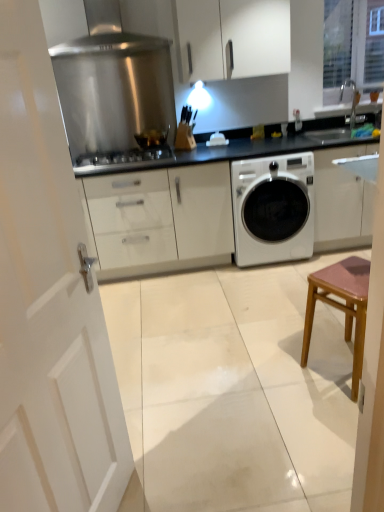
Where is `white wooden door at left`? The height and width of the screenshot is (512, 384). white wooden door at left is located at coordinates coord(49,303).

Measure the distance between point [162,146] and camera.

They are 3.43 meters apart.

What do you see at coordinates (94, 28) in the screenshot? The image size is (384, 512). I see `stainless steel exhaust hood at upper center` at bounding box center [94, 28].

What do you see at coordinates (152, 138) in the screenshot? The image size is (384, 512). I see `translucent glass cup at center` at bounding box center [152, 138].

What is the approximate height of white matte washing machine at center?

The height of white matte washing machine at center is 35.49 inches.

Locate an element on the screen. The width and height of the screenshot is (384, 512). pink wood stool at right is located at coordinates (341, 306).

Find the location of a particular element. sink in front of the translucent glass cup at center is located at coordinates (353, 106).

From the picture: Is black glossy sink at upper right with translucent glass cup at center?

There is a gap between black glossy sink at upper right and translucent glass cup at center.

From their relative heights in the image, would you say black glossy sink at upper right is taller or shorter than translucent glass cup at center?

black glossy sink at upper right is taller than translucent glass cup at center.

From the image's perspective, between black glossy sink at upper right and translucent glass cup at center, who is located below?

From the image's view, translucent glass cup at center is below.

From the image's perspective, which is below, white matte washing machine at center or pink wood stool at right?

pink wood stool at right is shown below in the image.

Is pink wood stool at right inside white matte washing machine at center?

That's incorrect, pink wood stool at right is not inside white matte washing machine at center.

How distant is white matte washing machine at center from pink wood stool at right?

The distance of white matte washing machine at center from pink wood stool at right is 1.17 meters.

Which object is thinner, white matte washing machine at center or pink wood stool at right?

With smaller width is pink wood stool at right.

Based on the photo, which object is thinner, stainless steel exhaust hood at upper center or white glossy cabinet at upper center?

With smaller width is white glossy cabinet at upper center.

Which is closer to the camera, [161,37] or [197,29]?

The point [197,29] is in front.

Is stainless steel exhaust hood at upper center positioned far away from white glossy cabinet at upper center?

Actually, stainless steel exhaust hood at upper center and white glossy cabinet at upper center are a little close together.

From the image's perspective, is stainless steel exhaust hood at upper center located above white glossy cabinet at upper center?

Actually, stainless steel exhaust hood at upper center appears below white glossy cabinet at upper center in the image.

From a real-world perspective, is stainless steel gas stove at center above or below white matte washing machine at center?

From a real-world perspective, stainless steel gas stove at center is physically above white matte washing machine at center.

From the image's perspective, is stainless steel gas stove at center located above or below white matte washing machine at center?

Clearly, from the image's perspective, stainless steel gas stove at center is above white matte washing machine at center.

Can you tell me how much stainless steel gas stove at center and white matte washing machine at center differ in facing direction?

0.000684 degrees separate the facing orientations of stainless steel gas stove at center and white matte washing machine at center.

Looking at this image, which object is thinner, stainless steel gas stove at center or white matte washing machine at center?

Thinner between the two is stainless steel gas stove at center.

Is the surface of pink wood stool at right in direct contact with translucent glass cup at center?

No, pink wood stool at right is not touching translucent glass cup at center.

Considering the relative positions of pink wood stool at right and translucent glass cup at center in the image provided, is pink wood stool at right to the right of translucent glass cup at center from the viewer's perspective?

Yes, pink wood stool at right is to the right of translucent glass cup at center.

Identify the location of stool that appears below the translucent glass cup at center (from the image's perspective). (341, 306).

From the image's perspective, is pink wood stool at right below translucent glass cup at center?

Yes.

From a real-world perspective, is white matte washing machine at center located beneath clear glass window at upper right?

Yes, from a real-world perspective, white matte washing machine at center is below clear glass window at upper right.

Is white matte washing machine at center surrounding clear glass window at upper right?

No, clear glass window at upper right is not surrounded by white matte washing machine at center.

Between white matte washing machine at center and clear glass window at upper right, which one appears on the right side from the viewer's perspective?

From the viewer's perspective, clear glass window at upper right appears more on the right side.

Is white wooden door at left to the right of polished stainless steel range hood at upper center from the viewer's perspective?

Yes, white wooden door at left is to the right of polished stainless steel range hood at upper center.

Is polished stainless steel range hood at upper center at the back of white wooden door at left?

No.

In terms of width, does white wooden door at left look wider or thinner when compared to polished stainless steel range hood at upper center?

Considering their sizes, white wooden door at left looks broader than polished stainless steel range hood at upper center.

In the image, there is a translucent glass cup at center. In order to click on sink above it (from the image's perspective) in this screenshot , I will do `click(353, 106)`.

Image resolution: width=384 pixels, height=512 pixels. What are the coordinates of `stool to the right of white matte washing machine at center` in the screenshot? It's located at (341, 306).

Estimate the real-world distances between objects in this image. Which object is further from stainless steel exhaust hood at upper center, white matte washing machine at center or stainless steel gas stove at center?

white matte washing machine at center is positioned further to the anchor stainless steel exhaust hood at upper center.

Considering their positions, is black glossy sink at upper right positioned further to white matte washing machine at center than white glossy cabinet at upper center?

black glossy sink at upper right.

Which object lies further to the anchor point white matte washing machine at center, polished stainless steel range hood at upper center or stainless steel gas stove at center?

Among the two, polished stainless steel range hood at upper center is located further to white matte washing machine at center.

In the scene shown: When comparing their distances from stainless steel exhaust hood at upper center, does white matte washing machine at center or clear glass window at upper right seem further?

The object further to stainless steel exhaust hood at upper center is clear glass window at upper right.

Based on their spatial positions, is stainless steel gas stove at center or pink wood stool at right further from white glossy cabinet at upper center?

pink wood stool at right is further to white glossy cabinet at upper center.

In the scene shown: Which object lies nearer to the anchor point black glossy sink at upper right, translucent glass cup at center or clear glass window at upper right?

clear glass window at upper right.

Considering their positions, is clear glass window at upper right positioned closer to polished stainless steel range hood at upper center than stainless steel exhaust hood at upper center?

The object closer to polished stainless steel range hood at upper center is stainless steel exhaust hood at upper center.

Estimate the real-world distances between objects in this image. Which object is closer to polished stainless steel range hood at upper center, white wooden door at left or white matte washing machine at center?

white matte washing machine at center is positioned closer to the anchor polished stainless steel range hood at upper center.

Where is `washing machine located between white wooden door at left and black glossy sink at upper right in the depth direction`? This screenshot has width=384, height=512. washing machine located between white wooden door at left and black glossy sink at upper right in the depth direction is located at coordinates (273, 209).

The image size is (384, 512). I want to click on exhaust hood between white wooden door at left and white matte washing machine at center from front to back, so click(x=94, y=28).

Image resolution: width=384 pixels, height=512 pixels. I want to click on cabinetry between polished stainless steel range hood at upper center and clear glass window at upper right in the horizontal direction, so click(x=231, y=38).

Find the location of a particular element. This screenshot has width=384, height=512. home appliance between stainless steel exhaust hood at upper center and clear glass window at upper right from left to right is located at coordinates (112, 84).